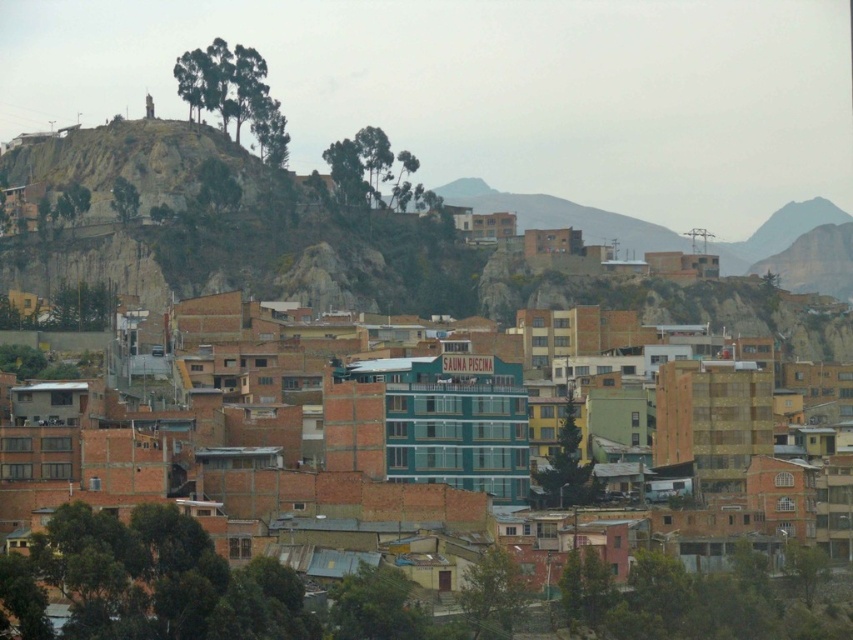
Question: Which object is farther from the camera taking this photo?

Choices:
 (A) brown brick buildings at center
 (B) rustic stone hill at upper left

Answer: (B)

Question: Is brown brick buildings at center bigger than rustic stone hill at upper left?

Choices:
 (A) yes
 (B) no

Answer: (B)

Question: Which point is closer to the camera taking this photo?

Choices:
 (A) click(392, 225)
 (B) click(726, 637)

Answer: (B)

Question: Among these points, which one is nearest to the camera?

Choices:
 (A) (300, 620)
 (B) (88, 168)

Answer: (A)

Question: Is brown brick buildings at center positioned behind rustic stone hill at upper left?

Choices:
 (A) yes
 (B) no

Answer: (B)

Question: Does brown brick buildings at center have a smaller size compared to rustic stone hill at upper left?

Choices:
 (A) no
 (B) yes

Answer: (B)